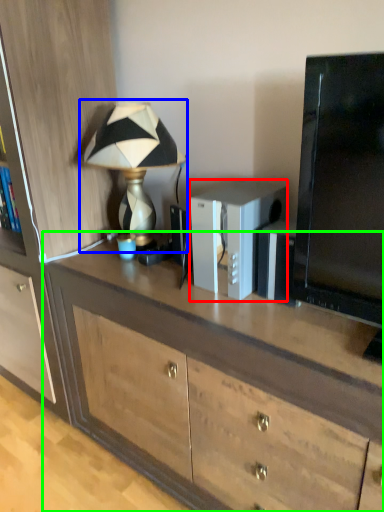
Question: Based on their relative distances, which object is farther from appliance (highlighted by a red box)? Choose from lamp (highlighted by a blue box) and desk (highlighted by a green box).

Choices:
 (A) lamp
 (B) desk

Answer: (A)